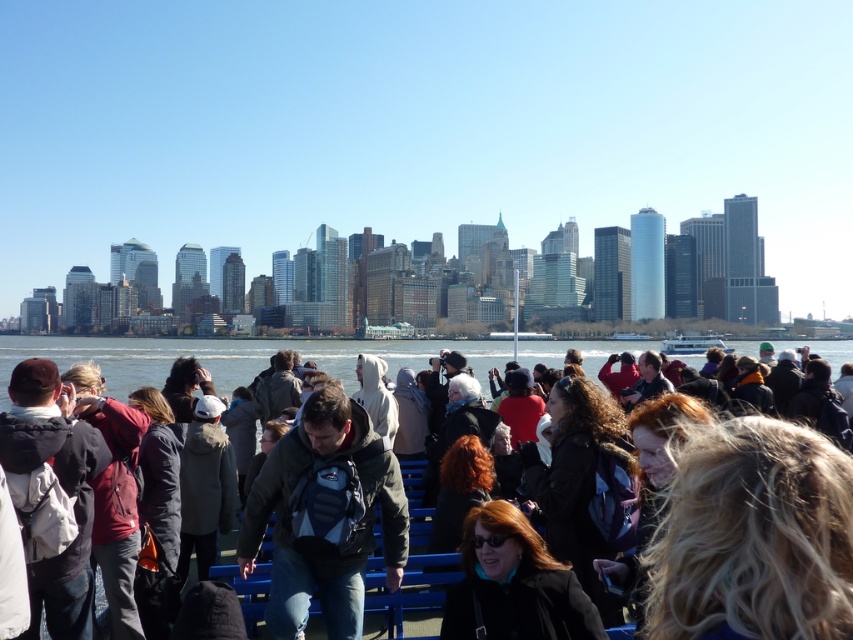
Question: Which point is closer to the camera?

Choices:
 (A) matte black jacket at center
 (B) dark brown leather jacket at center
 (C) matte red jacket at left
 (D) blonde hair at lower right

Answer: (D)

Question: Which of the following is the closest to the observer?

Choices:
 (A) (619, 456)
 (B) (270, 352)
 (C) (126, 611)

Answer: (C)

Question: Can you confirm if blonde hair at lower right is positioned above dark gray backpack at left?

Choices:
 (A) yes
 (B) no

Answer: (A)

Question: Considering the real-world distances, which object is farthest from the matte red jacket at left?

Choices:
 (A) blonde hair at lower right
 (B) dark brown leather jacket at center
 (C) matte black jacket at center
 (D) dark gray backpack at left

Answer: (A)

Question: Does clear water at center come behind dark gray backpack at left?

Choices:
 (A) yes
 (B) no

Answer: (A)

Question: Is dark gray backpack at left positioned before matte black jacket at center?

Choices:
 (A) yes
 (B) no

Answer: (B)